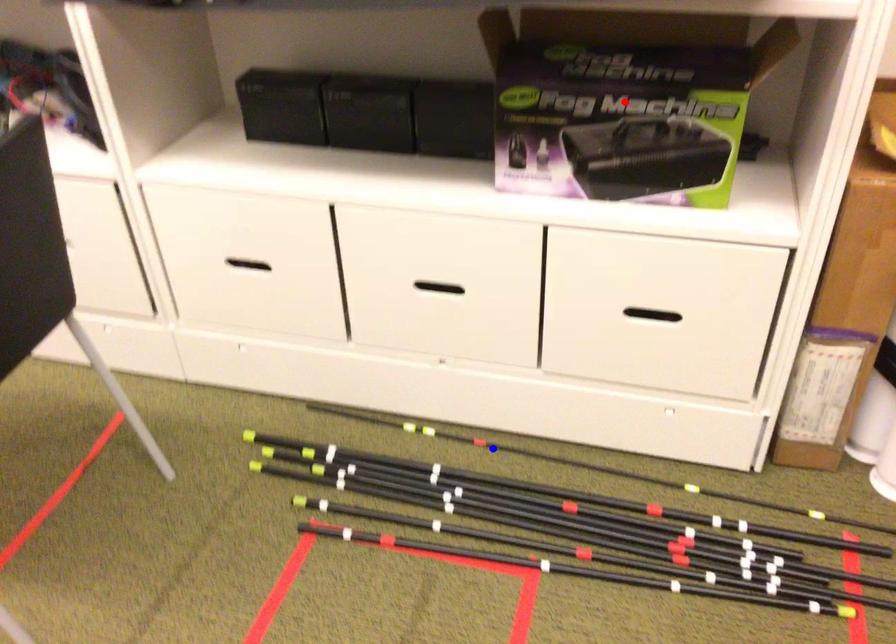
Question: In the image, two points are highlighted. Which point is nearer to the camera? Reply with the corresponding letter.

Choices:
 (A) blue point
 (B) red point

Answer: (B)